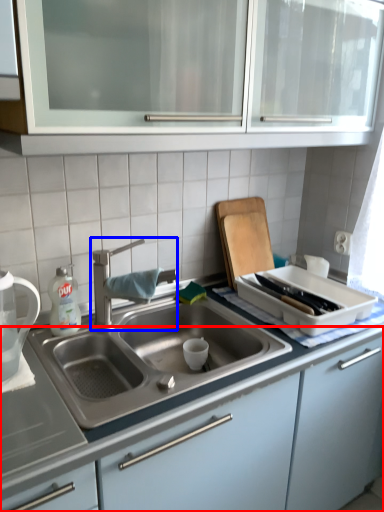
Question: Among these objects, which one is farthest to the camera, cabinetry (highlighted by a red box) or tap (highlighted by a blue box)?

Choices:
 (A) cabinetry
 (B) tap

Answer: (B)